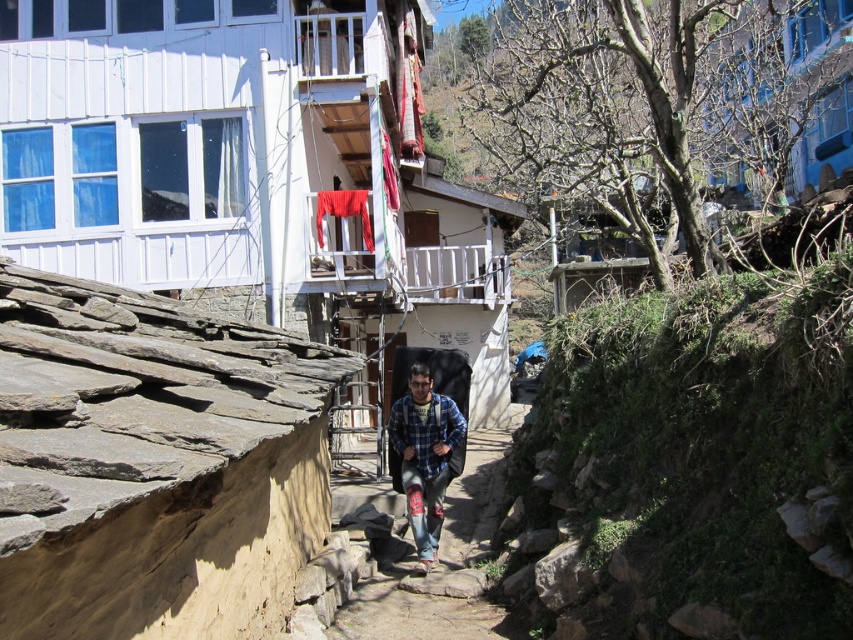
Does denim jeans at center appear on the right side of blue plaid shirt at center?

Correct, you'll find denim jeans at center to the right of blue plaid shirt at center.

What do you see at coordinates (439, 563) in the screenshot?
I see `denim jeans at center` at bounding box center [439, 563].

You are a GUI agent. You are given a task and a screenshot of the screen. Output one action in this format:
    pyautogui.click(x=<x>, y=<y>)
    Task: Click on the denim jeans at center
    
    Given the screenshot: What is the action you would take?
    pyautogui.click(x=439, y=563)